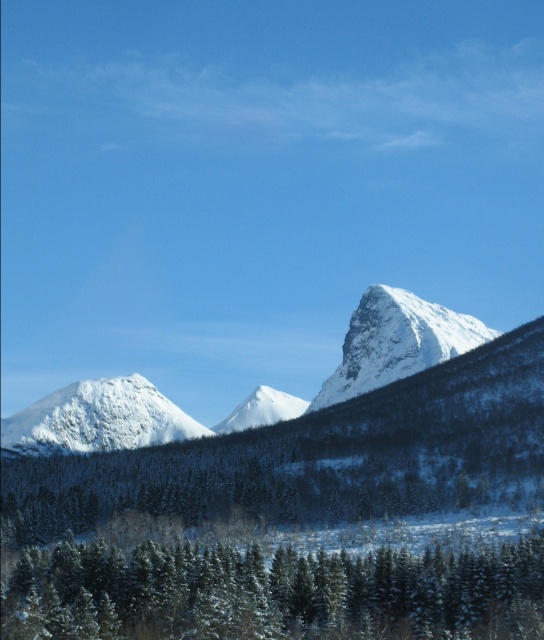
Question: In this image, where is white snow-covered mountain at left located relative to white snow-covered peak at center?

Choices:
 (A) below
 (B) above

Answer: (A)

Question: Which of the following is the closest to the observer?

Choices:
 (A) (231, 413)
 (B) (508, 580)
 (C) (368, 307)
 (D) (94, 410)

Answer: (B)

Question: Does snowy evergreen trees at center appear under white snow-covered peak at center?

Choices:
 (A) yes
 (B) no

Answer: (A)

Question: Among these points, which one is nearest to the camera?

Choices:
 (A) (143, 381)
 (B) (290, 410)

Answer: (A)

Question: Where is snowy evergreen trees at center located in relation to white snow-covered mountain at center in the image?

Choices:
 (A) left
 (B) right

Answer: (B)

Question: Which of the following is the farthest from the observer?

Choices:
 (A) white snow-covered peak at center
 (B) snowy evergreen trees at center
 (C) white snow-covered mountain at left

Answer: (A)